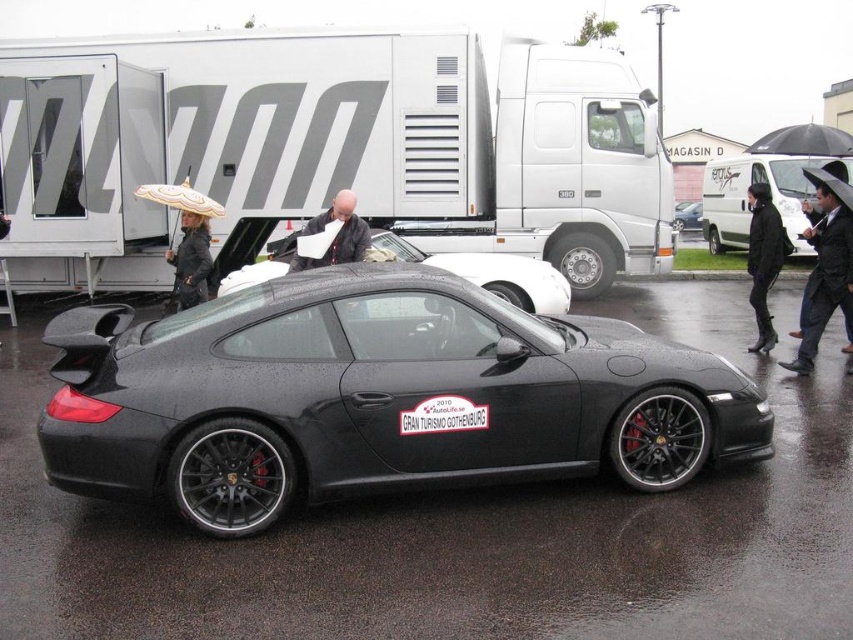
You are attending the car show and want to take a photo of the black leather jacket at right and the white matte umbrella at upper left. Which object is positioned lower in the image?

The black leather jacket at right is located below the white matte umbrella at upper left, so the black leather jacket at right is positioned lower in the image.

You are at a car show and see a black leather jacket at right and a white matte umbrella at upper left. Which object is positioned more to the right side of the scene?

The black leather jacket at right is positioned more to the right side of the scene than the white matte umbrella at upper left.

You are standing at the point labeled point (772, 204) and want to walk to the Porsche sports car. How far will you have to walk?

The distance between the point labeled point (772, 204) and the Porsche sports car is 11.73 meters, so you will have to walk 11.73 meters.